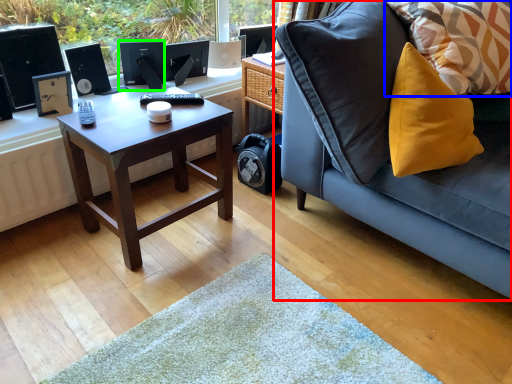
Question: Which is nearer to the studio couch (highlighted by a red box)? pillow (highlighted by a blue box) or computer monitor (highlighted by a green box).

Choices:
 (A) pillow
 (B) computer monitor

Answer: (A)